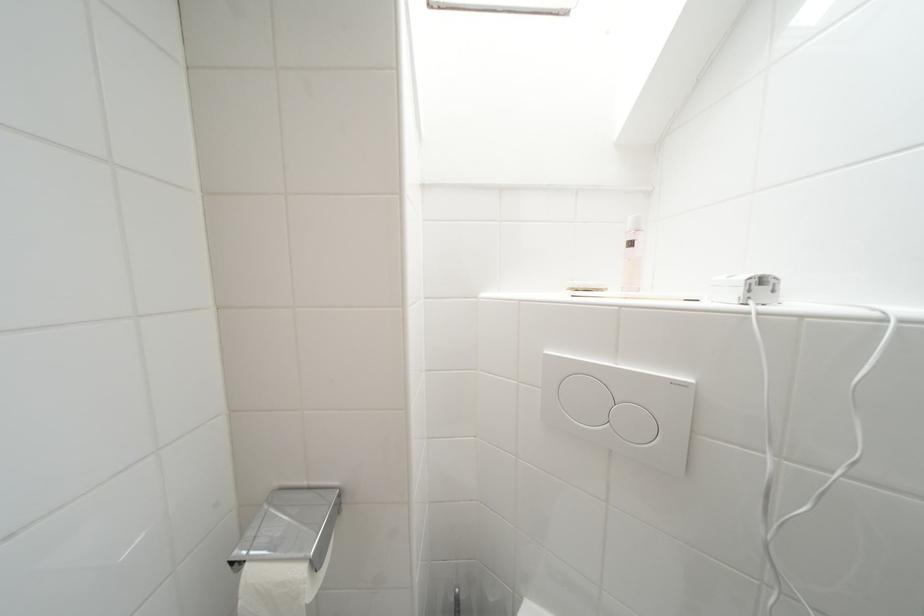
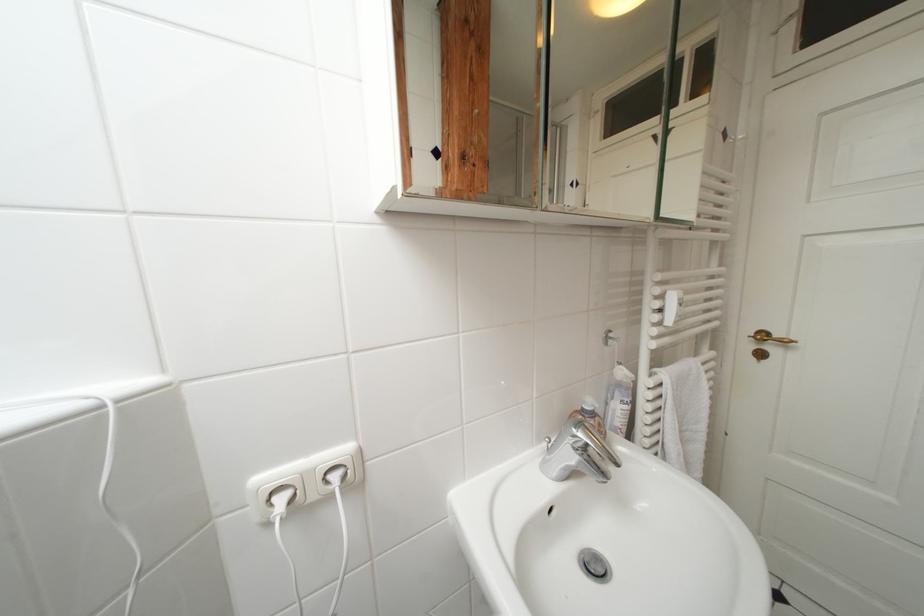
Question: How did the camera likely rotate?

Choices:
 (A) Left
 (B) Right
 (C) Up
 (D) Down

Answer: (B)